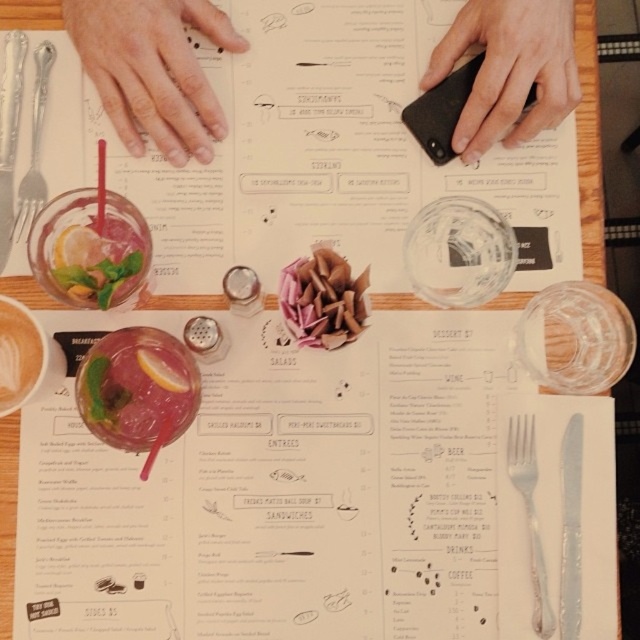
Looking at this image, what is the position of the pink paper flower at center?

The pink paper flower at center is located at point 0.469 on the x axis and 0.505 on the y axis.

You are a diner sitting at the table and want to pick up the silver metallic fork at center. Which direction should you move your hand from the silver metallic fork at left to reach it?

You should move your hand to the right from the silver metallic fork at left to reach the silver metallic fork at center, since the silver metallic fork at center is to the right of the silver metallic fork at left.

You are a waiter at the restaurant and need to place a new silver metallic fork between the existing silver metallic fork at center and the silver metallic fork at left. Can you do this without moving the existing forks?

The silver metallic fork at center is located below the silver metallic fork at left, so placing a new fork between them would require moving one of the existing forks since they are vertically aligned.